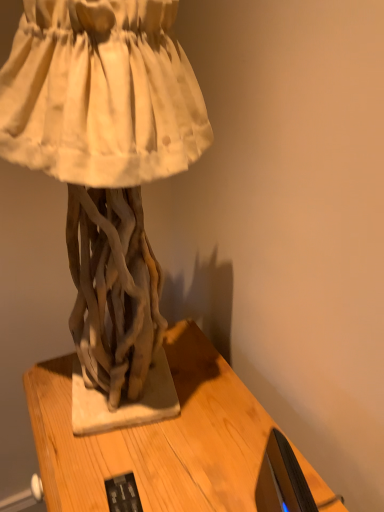
Locate an element on the screen. Image resolution: width=384 pixels, height=512 pixels. free region under matte driftwood sculpture at center (from a real-world perspective) is located at coordinates (137, 416).